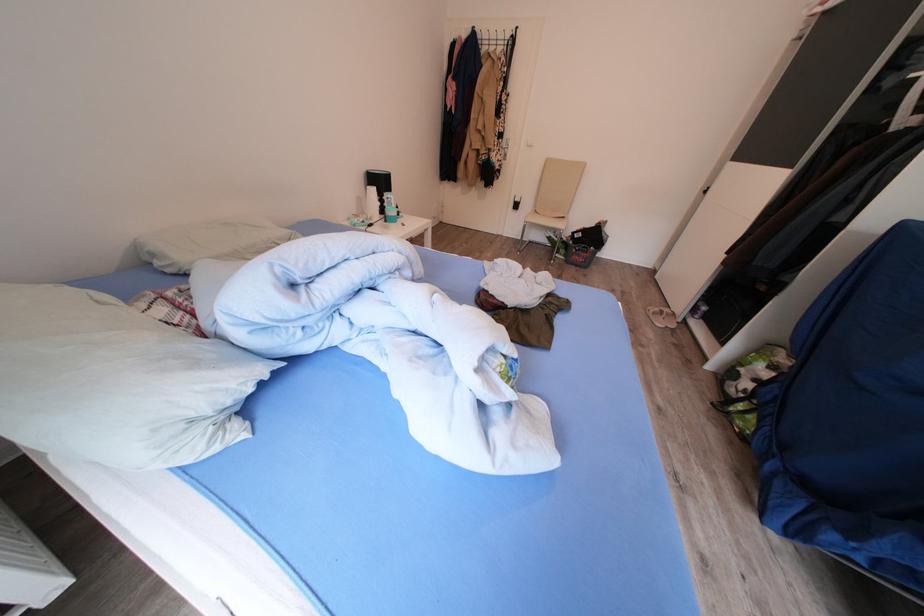
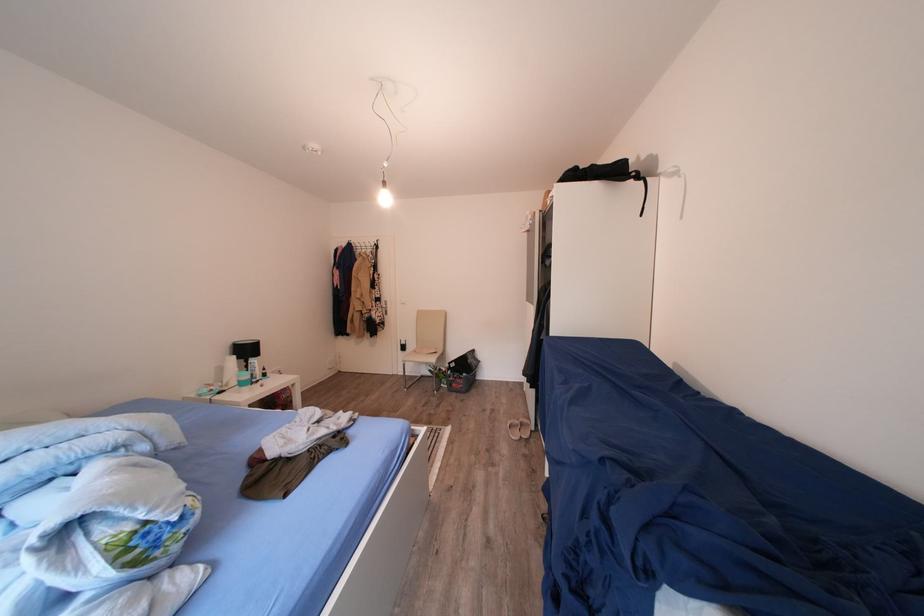
Locate, in the second image, the point that corresponds to the point at 574,261 in the first image.

(456, 390)